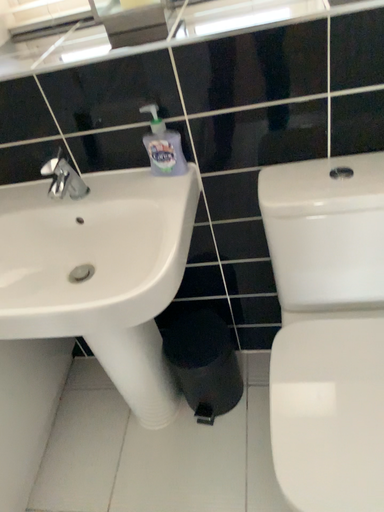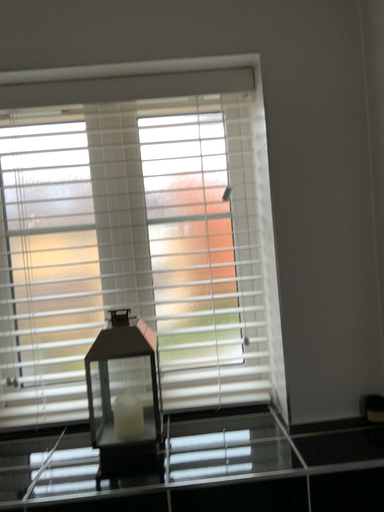
Question: How did the camera likely rotate when shooting the video?

Choices:
 (A) rotated left
 (B) rotated right

Answer: (B)